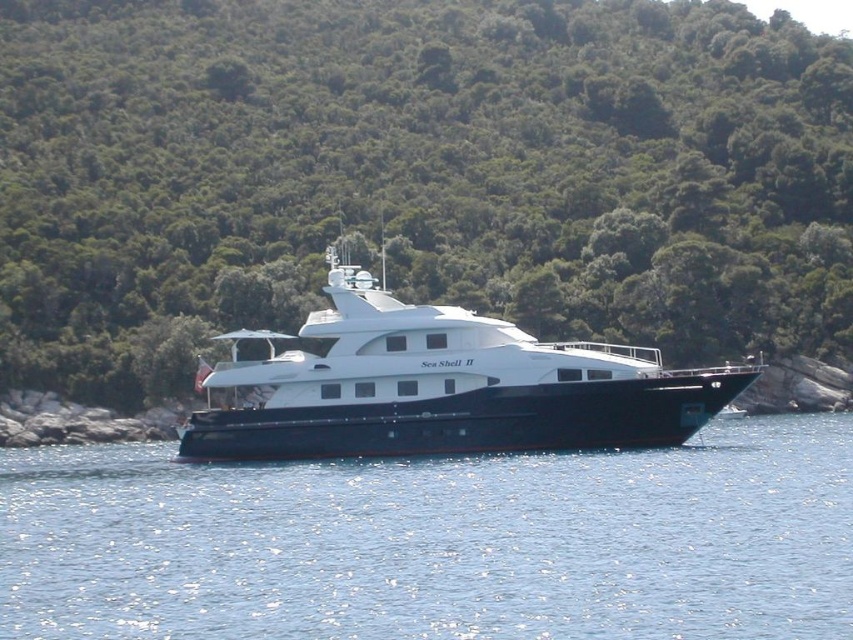
Does green leafy trees at center have a larger size compared to white glossy cruise ship at center?

Indeed, green leafy trees at center has a larger size compared to white glossy cruise ship at center.

Can you confirm if green leafy trees at center is positioned to the left of white glossy cruise ship at center?

Correct, you'll find green leafy trees at center to the left of white glossy cruise ship at center.

The height and width of the screenshot is (640, 853). What do you see at coordinates (416, 172) in the screenshot?
I see `green leafy trees at center` at bounding box center [416, 172].

I want to click on green leafy trees at center, so click(416, 172).

Does green leafy trees at center appear on the left side of blue water at center?

Indeed, green leafy trees at center is positioned on the left side of blue water at center.

Who is taller, green leafy trees at center or blue water at center?

Standing taller between the two is green leafy trees at center.

The height and width of the screenshot is (640, 853). In order to click on green leafy trees at center in this screenshot , I will do `click(416, 172)`.

Identify the location of green leafy trees at center. (416, 172).

Can you confirm if blue water at center is thinner than white glossy cruise ship at center?

Incorrect, blue water at center's width is not less than white glossy cruise ship at center's.

Is point (79, 632) closer to camera compared to point (311, 406)?

Yes, point (79, 632) is in front of point (311, 406).

Between point (819, 444) and point (701, 412), which one is positioned in front?

Positioned in front is point (701, 412).

Identify the location of blue water at center. The image size is (853, 640). (438, 541).